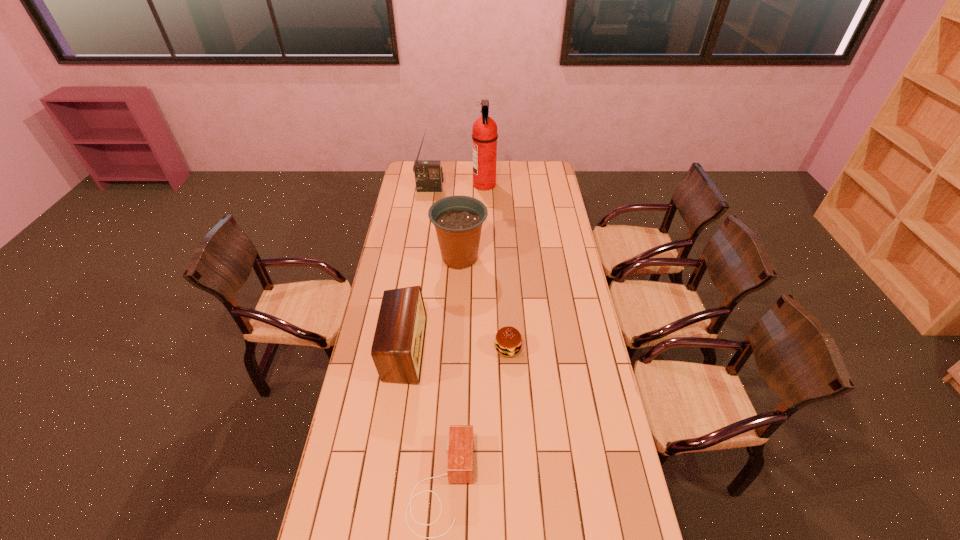
Where is `blank space located on the side of the fire extinguisher near the handle`? Image resolution: width=960 pixels, height=540 pixels. blank space located on the side of the fire extinguisher near the handle is located at coordinates coord(447,185).

Where is `free region located on the side of the fire extinguisher near the handle`? The image size is (960, 540). free region located on the side of the fire extinguisher near the handle is located at coordinates pos(427,185).

Where is `free space located on the side of the fire extinguisher near the handle`? free space located on the side of the fire extinguisher near the handle is located at coordinates (429, 185).

This screenshot has height=540, width=960. Find the location of `free space located 0.330m on the display of the fifth shortest object`. free space located 0.330m on the display of the fifth shortest object is located at coordinates (424, 227).

Locate an element on the screen. This screenshot has height=540, width=960. free spot located 0.290m on the front of the third farthest object is located at coordinates (457, 325).

You are a GUI agent. You are given a task and a screenshot of the screen. Output one action in this format:
    pyautogui.click(x=<x>, y=<y>)
    Task: Click on the free spot located on the front-facing side of the second nearest radio receiver
    The height and width of the screenshot is (540, 960).
    Given the screenshot: What is the action you would take?
    pyautogui.click(x=448, y=349)

Where is `vacant space located 0.110m on the right of the hamburger`? vacant space located 0.110m on the right of the hamburger is located at coordinates (550, 348).

This screenshot has width=960, height=540. I want to click on free space located on the front-facing side of the shortest radio receiver, so click(601, 484).

The image size is (960, 540). I want to click on object positioned at the far edge, so click(x=484, y=129).

Image resolution: width=960 pixels, height=540 pixels. In order to click on free location at the far edge of the desktop in this screenshot , I will do `click(510, 168)`.